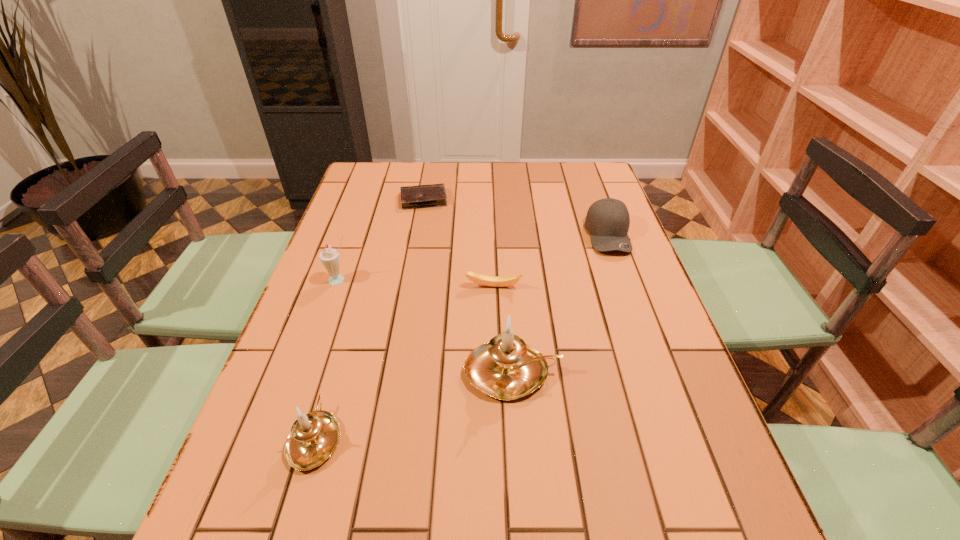
Please point a spot on the right to add another candle holder. Please provide its 2D coordinates. Your answer should be formatted as a tuple, i.e. [(x, y)], where the tuple contains the x and y coordinates of a point satisfying the conditions above.

[(668, 321)]